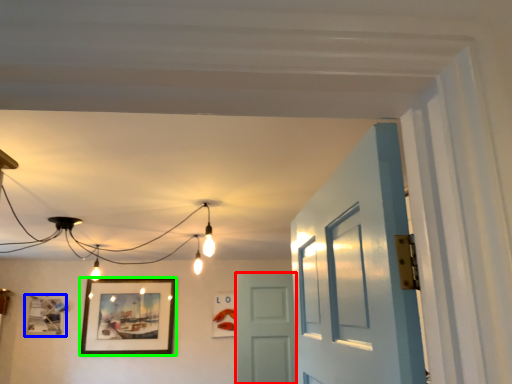
Question: Which object is positioned farthest from door (highlighted by a red box)? Select from picture frame (highlighted by a blue box) and picture frame (highlighted by a green box).

Choices:
 (A) picture frame
 (B) picture frame

Answer: (A)